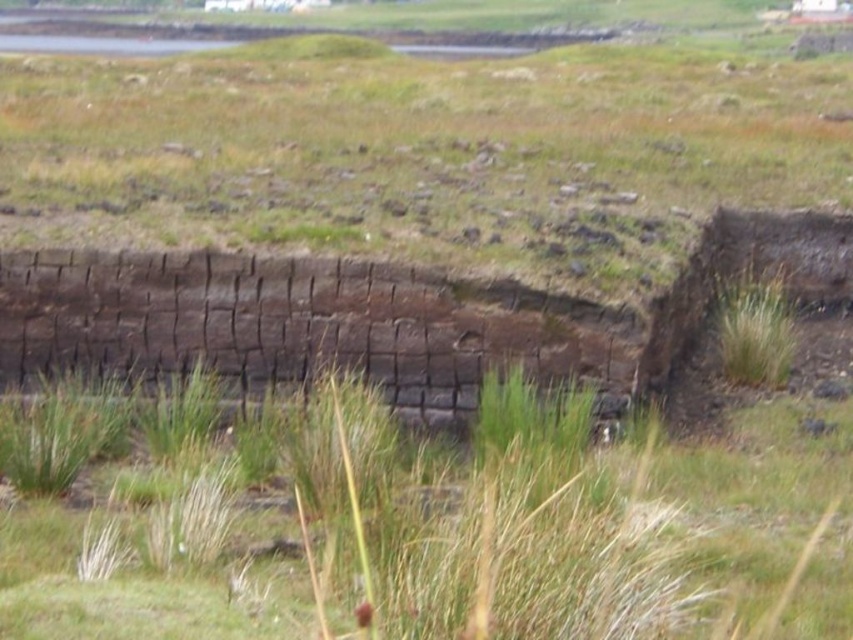
Question: Which object is farther from the camera taking this photo?

Choices:
 (A) green grassy at center
 (B) brown stone wall at center

Answer: (B)

Question: Which point appears closest to the camera in this image?

Choices:
 (A) (238, 300)
 (B) (540, 588)

Answer: (B)

Question: Is green grassy at center below brown stone wall at center?

Choices:
 (A) no
 (B) yes

Answer: (B)

Question: Is green grassy at center bigger than brown stone wall at center?

Choices:
 (A) no
 (B) yes

Answer: (B)

Question: Does green grassy at center have a larger size compared to brown stone wall at center?

Choices:
 (A) yes
 (B) no

Answer: (A)